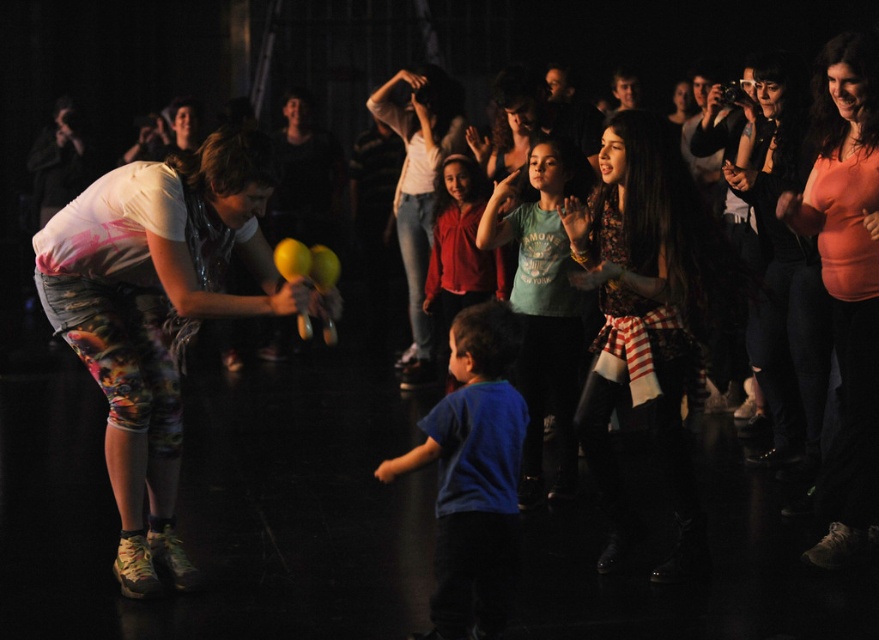
What is located at the coordinates point (156, 314)?

The printed leggings at left are located at point (156, 314).

You are a photographer trying to capture a group photo of the orange matte shirt at upper right and the matte red shirt at center. The camera you are using has a maximum focus range of 10 feet. Will both subjects be in focus if you take the photo from your current position?

The orange matte shirt at upper right and the matte red shirt at center are 9.77 feet apart from each other. Since the distance between them is within the camera maximum focus range of 10 feet, both subjects will be in focus.

Looking at the scene, which object is bigger between the printed leggings at left and the printed fabric shirt at center?

The printed leggings at left is larger in size than the printed fabric shirt at center.